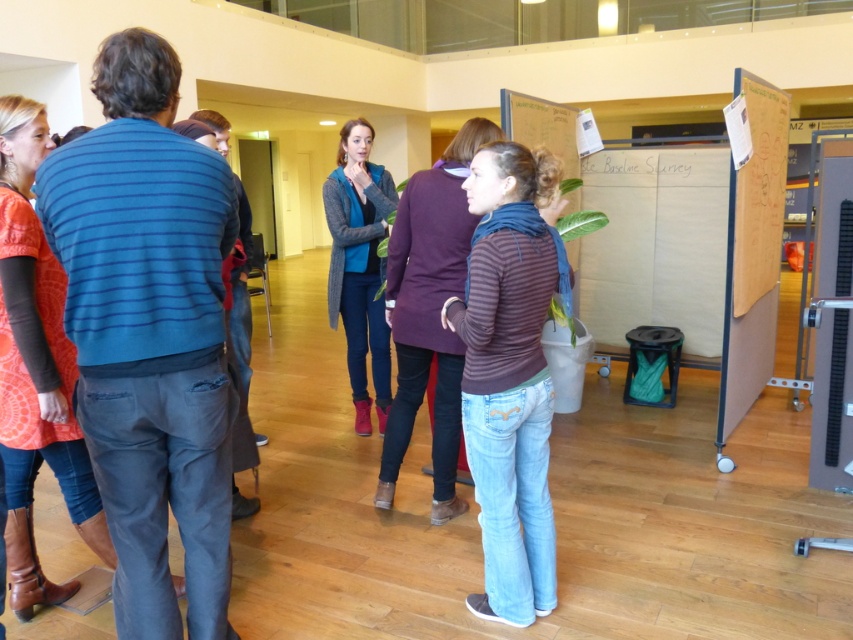
Question: Among these points, which one is farthest from the camera?

Choices:
 (A) (115, 596)
 (B) (679, 244)
 (C) (375, 376)
 (D) (517, 280)

Answer: (B)

Question: Observing the image, what is the correct spatial positioning of white cardboard bulletin board at center in reference to knitted sweater at center?

Choices:
 (A) left
 (B) right

Answer: (B)

Question: Which point is farther from the camera taking this photo?

Choices:
 (A) (505, 212)
 (B) (679, 308)

Answer: (B)

Question: Estimate the real-world distances between objects in this image. Which object is closer to the white cardboard bulletin board at center?

Choices:
 (A) striped cotton shirt at center
 (B) blue striped sweater at left
 (C) knitted sweater at center

Answer: (C)

Question: In this image, where is striped cotton shirt at center located relative to white cardboard bulletin board at center?

Choices:
 (A) below
 (B) above

Answer: (A)

Question: Does blue striped sweater at left have a smaller size compared to striped cotton shirt at center?

Choices:
 (A) yes
 (B) no

Answer: (B)